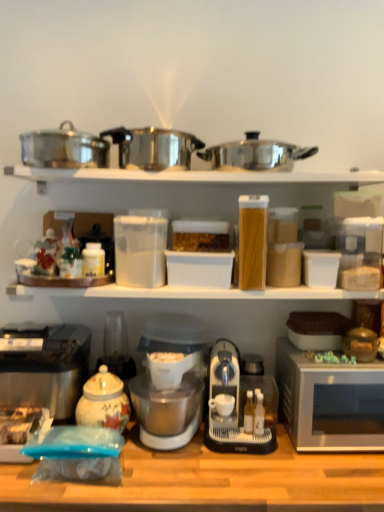
Question: Does stainless steel crock pot at upper left, the first crock pot when ordered from left to right, have a lesser height compared to wooden table at lower center?

Choices:
 (A) yes
 (B) no

Answer: (A)

Question: Is stainless steel crock pot at upper left, the third crock pot from the right, smaller than wooden table at lower center?

Choices:
 (A) yes
 (B) no

Answer: (A)

Question: Is stainless steel crock pot at upper left, the third crock pot from the right, facing away from wooden table at lower center?

Choices:
 (A) yes
 (B) no

Answer: (B)

Question: Is the depth of stainless steel crock pot at upper left, the first crock pot when ordered from left to right, greater than that of wooden table at lower center?

Choices:
 (A) no
 (B) yes

Answer: (B)

Question: Is stainless steel crock pot at upper left, the third crock pot from the right, to the right of wooden table at lower center from the viewer's perspective?

Choices:
 (A) yes
 (B) no

Answer: (B)

Question: Is there a large distance between stainless steel crock pot at upper left, the third crock pot from the right, and wooden table at lower center?

Choices:
 (A) yes
 (B) no

Answer: (B)

Question: Is silver metallic microwave at right positioned with its back to porcelain floral jar at center, acting as the 1th appliance starting from the bottom?

Choices:
 (A) no
 (B) yes

Answer: (A)

Question: Considering the relative positions of silver metallic microwave at right and porcelain floral jar at center, which appears as the 2th appliance when viewed from the right, in the image provided, is silver metallic microwave at right to the left of porcelain floral jar at center, which appears as the 2th appliance when viewed from the right, from the viewer's perspective?

Choices:
 (A) no
 (B) yes

Answer: (A)

Question: Is there a large distance between silver metallic microwave at right and porcelain floral jar at center, which is counted as the first appliance, starting from the left?

Choices:
 (A) no
 (B) yes

Answer: (A)

Question: Is silver metallic microwave at right facing towards porcelain floral jar at center, acting as the 1th appliance starting from the bottom?

Choices:
 (A) yes
 (B) no

Answer: (B)

Question: Is silver metallic microwave at right positioned before porcelain floral jar at center, which is counted as the first appliance, starting from the left?

Choices:
 (A) yes
 (B) no

Answer: (A)

Question: From a real-world perspective, is silver metallic microwave at right located beneath porcelain floral jar at center, which is counted as the first appliance, starting from the left?

Choices:
 (A) no
 (B) yes

Answer: (B)

Question: From the image's perspective, would you say clear plastic container at upper center, the 2th appliance from the bottom, is shown under wooden table at lower center?

Choices:
 (A) no
 (B) yes

Answer: (A)